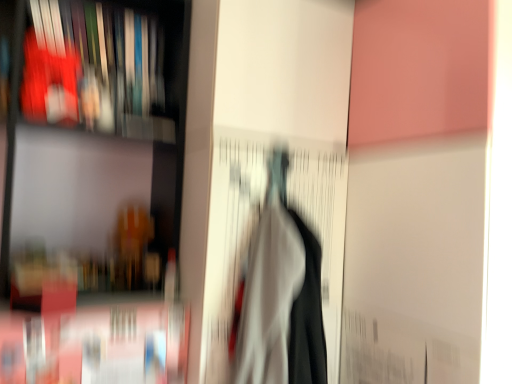
Question: Is matte plastic book at upper left at the left side of matte black bookshelf at left?

Choices:
 (A) yes
 (B) no

Answer: (B)

Question: Can we say matte plastic book at upper left lies outside matte black bookshelf at left?

Choices:
 (A) yes
 (B) no

Answer: (B)

Question: Does matte plastic book at upper left have a smaller size compared to matte black bookshelf at left?

Choices:
 (A) no
 (B) yes

Answer: (B)

Question: Is the depth of matte plastic book at upper left greater than that of matte black bookshelf at left?

Choices:
 (A) yes
 (B) no

Answer: (A)

Question: Is matte plastic book at upper left facing towards matte black bookshelf at left?

Choices:
 (A) yes
 (B) no

Answer: (A)

Question: From the image's perspective, does matte plastic book at upper left appear higher than matte black bookshelf at left?

Choices:
 (A) no
 (B) yes

Answer: (B)

Question: Is white fabric at center positioned before matte black bookshelf at left?

Choices:
 (A) yes
 (B) no

Answer: (A)

Question: Considering the relative sizes of white fabric at center and matte black bookshelf at left in the image provided, is white fabric at center shorter than matte black bookshelf at left?

Choices:
 (A) yes
 (B) no

Answer: (A)

Question: From a real-world perspective, is white fabric at center located higher than matte black bookshelf at left?

Choices:
 (A) no
 (B) yes

Answer: (A)

Question: From the image's perspective, is white fabric at center beneath matte black bookshelf at left?

Choices:
 (A) yes
 (B) no

Answer: (A)

Question: Would you say white fabric at center contains matte black bookshelf at left?

Choices:
 (A) yes
 (B) no

Answer: (B)

Question: Considering the relative sizes of white fabric at center and matte black bookshelf at left in the image provided, is white fabric at center smaller than matte black bookshelf at left?

Choices:
 (A) yes
 (B) no

Answer: (A)

Question: Can you confirm if white fabric at center is shorter than matte plastic book at upper left?

Choices:
 (A) no
 (B) yes

Answer: (A)